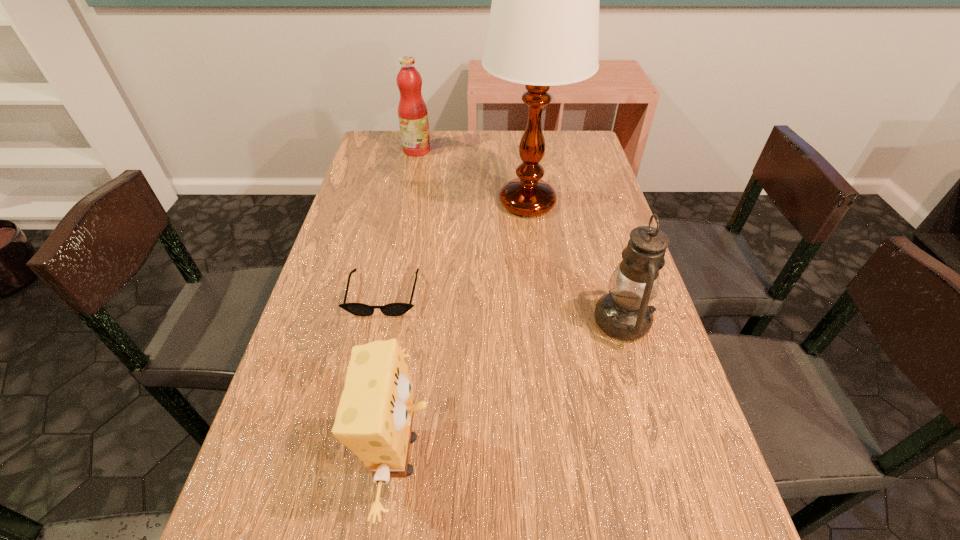
This screenshot has width=960, height=540. I want to click on fruit juice present at the left edge, so click(412, 111).

Where is `sunglasses at the left edge`? Image resolution: width=960 pixels, height=540 pixels. sunglasses at the left edge is located at coordinates (393, 309).

Where is `table lamp located at the right edge`? The image size is (960, 540). table lamp located at the right edge is located at coordinates (543, 30).

The image size is (960, 540). In order to click on oil lamp at the right edge in this screenshot , I will do `click(624, 313)`.

Identify the location of object situated at the far left corner. Image resolution: width=960 pixels, height=540 pixels. (412, 111).

I want to click on vacant space at the far edge, so click(x=437, y=147).

Image resolution: width=960 pixels, height=540 pixels. I want to click on free space at the left edge, so click(x=344, y=217).

This screenshot has width=960, height=540. What are the coordinates of `free space at the right edge of the desktop` in the screenshot? It's located at (580, 300).

At what (x,y) coordinates should I click in order to perform the action: click on vacant area at the far left corner of the desktop. Please return your answer as a coordinate pair (x, y). This screenshot has width=960, height=540. Looking at the image, I should click on (396, 134).

Image resolution: width=960 pixels, height=540 pixels. In order to click on free space at the far right corner of the desktop in this screenshot , I will do `click(558, 144)`.